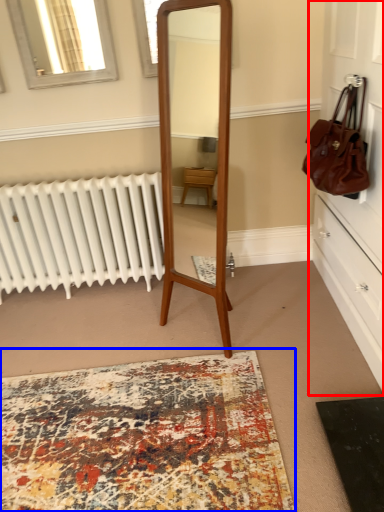
Question: Which object appears closest to the camera in this image, dresser (highlighted by a red box) or mat (highlighted by a blue box)?

Choices:
 (A) dresser
 (B) mat

Answer: (A)